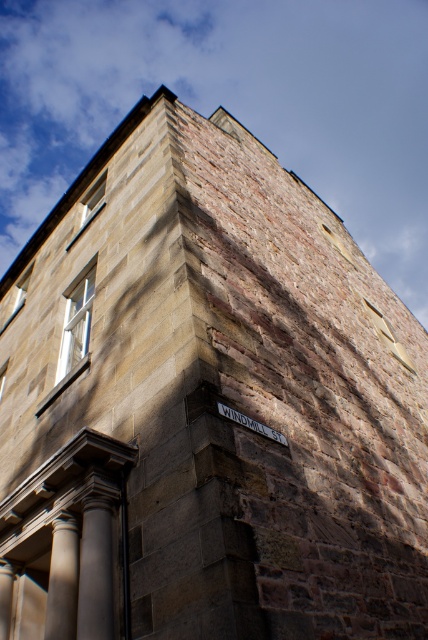
Can you confirm if dark gray stone column at lower left is positioned below smooth stone column at lower left?

No, dark gray stone column at lower left is not below smooth stone column at lower left.

The height and width of the screenshot is (640, 428). Describe the element at coordinates (95, 572) in the screenshot. I see `dark gray stone column at lower left` at that location.

Which is behind, point (91, 554) or point (61, 600)?

Positioned behind is point (61, 600).

Locate an element on the screen. dark gray stone column at lower left is located at coordinates (95, 572).

Does dark gray stone column at lower left have a greater width compared to metallic street sign at upper right?

No.

The height and width of the screenshot is (640, 428). In order to click on dark gray stone column at lower left in this screenshot , I will do `click(95, 572)`.

Image resolution: width=428 pixels, height=640 pixels. What do you see at coordinates (95, 572) in the screenshot? I see `dark gray stone column at lower left` at bounding box center [95, 572].

Find the location of a particular element. dark gray stone column at lower left is located at coordinates (95, 572).

Is smooth stone column at lower left taller than metallic street sign at upper right?

Correct, smooth stone column at lower left is much taller as metallic street sign at upper right.

Does smooth stone column at lower left have a lesser height compared to metallic street sign at upper right?

Incorrect, smooth stone column at lower left's height does not fall short of metallic street sign at upper right's.

Where is `smooth stone column at lower left`? smooth stone column at lower left is located at coordinates pyautogui.click(x=62, y=579).

I want to click on smooth stone column at lower left, so click(x=62, y=579).